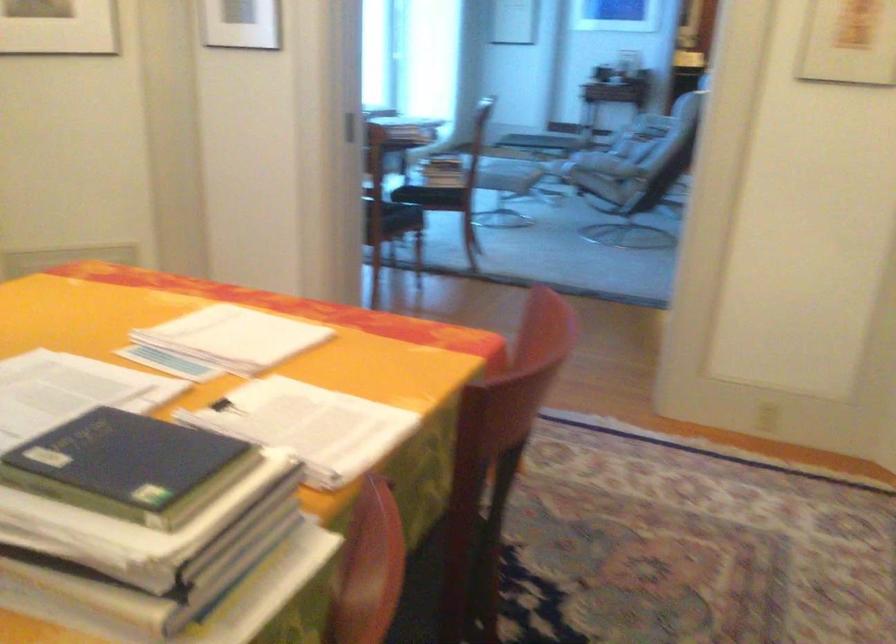
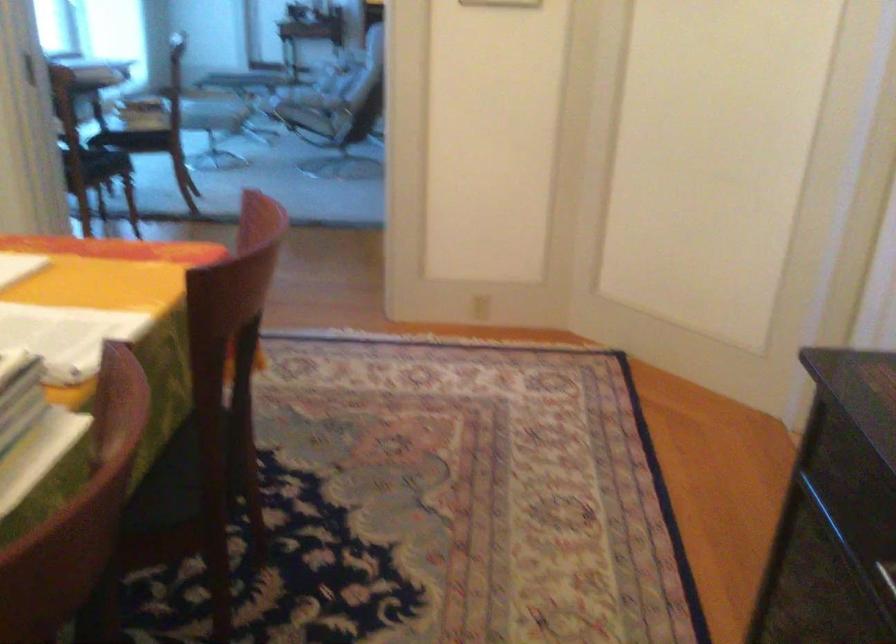
Question: The camera is either moving clockwise (left) or counter-clockwise (right) around the object. The first image is from the beginning of the video and the second image is from the end. Is the camera moving left or right when shooting the video?

Choices:
 (A) Left
 (B) Right

Answer: (A)